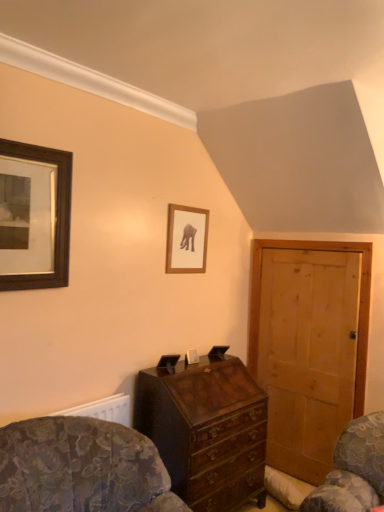
Question: Does point (172, 220) appear closer or farther from the camera than point (216, 432)?

Choices:
 (A) closer
 (B) farther

Answer: (B)

Question: In terms of width, does wooden framed picture at center, the first picture frame positioned from the back, look wider or thinner when compared to mahogany wooden chest of drawers at center?

Choices:
 (A) thin
 (B) wide

Answer: (A)

Question: Estimate the real-world distances between objects in this image. Which object is closer to the wooden framed picture at upper left, positioned as the first picture frame in left-to-right order?

Choices:
 (A) natural wood door at right
 (B) wooden framed picture at center, positioned as the 1th picture frame in right-to-left order
 (C) patterned fabric rocking chair at lower left
 (D) mahogany wooden chest of drawers at center

Answer: (C)

Question: Which of these objects is positioned farthest from the wooden framed picture at center, the first picture frame positioned from the back?

Choices:
 (A) wooden framed picture at upper left, which is the second picture frame in back-to-front order
 (B) mahogany wooden chest of drawers at center
 (C) patterned fabric rocking chair at lower left
 (D) natural wood door at right

Answer: (C)